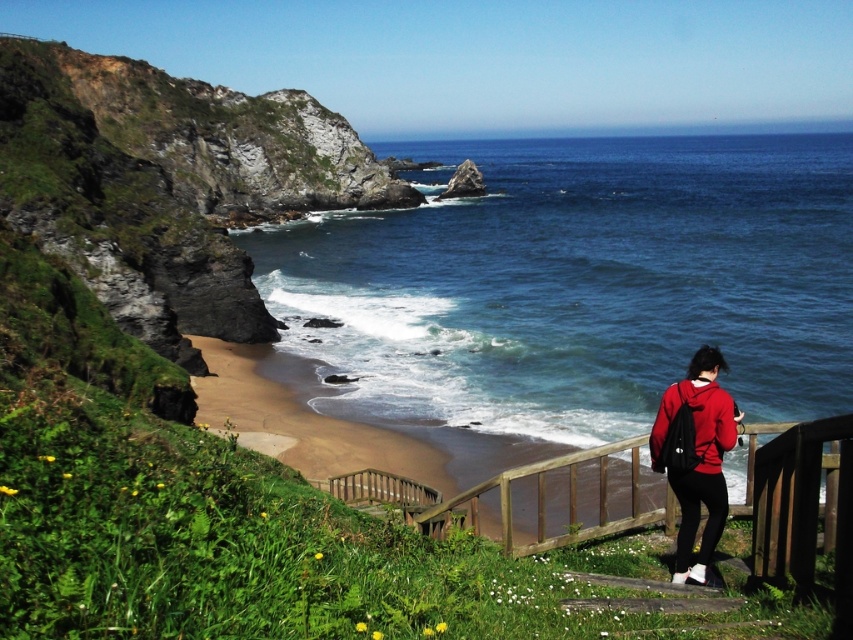
Which of these two, red matte jacket at lower right or wooden at lower right, stands taller?

With more height is wooden at lower right.

Where is `red matte jacket at lower right`? Image resolution: width=853 pixels, height=640 pixels. red matte jacket at lower right is located at coordinates (698, 456).

Is point (692, 488) behind point (643, 442)?

That is False.

Locate an element on the screen. red matte jacket at lower right is located at coordinates (698, 456).

Measure the distance between point (x=590, y=528) and camera.

Point (x=590, y=528) is 19.65 meters away from camera.

Is wooden at lower right above matte red jacket at lower right?

No, wooden at lower right is not above matte red jacket at lower right.

Is point (755, 424) farther from camera compared to point (654, 452)?

Yes, point (755, 424) is behind point (654, 452).

Identify the location of wooden at lower right. (544, 499).

Between point (683, 512) and point (726, 394), which one is positioned behind?

The point (683, 512) is behind.

You are a GUI agent. You are given a task and a screenshot of the screen. Output one action in this format:
    pyautogui.click(x=<x>, y=<y>)
    Task: Click on the red matte jacket at lower right
    
    Given the screenshot: What is the action you would take?
    pyautogui.click(x=698, y=456)